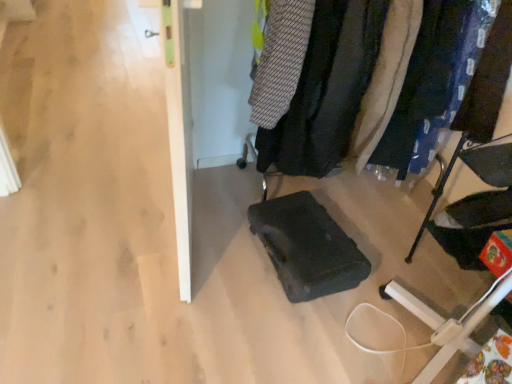
Where is `free space that is to the left of black fabric chair at lower right`? The height and width of the screenshot is (384, 512). free space that is to the left of black fabric chair at lower right is located at coordinates (386, 253).